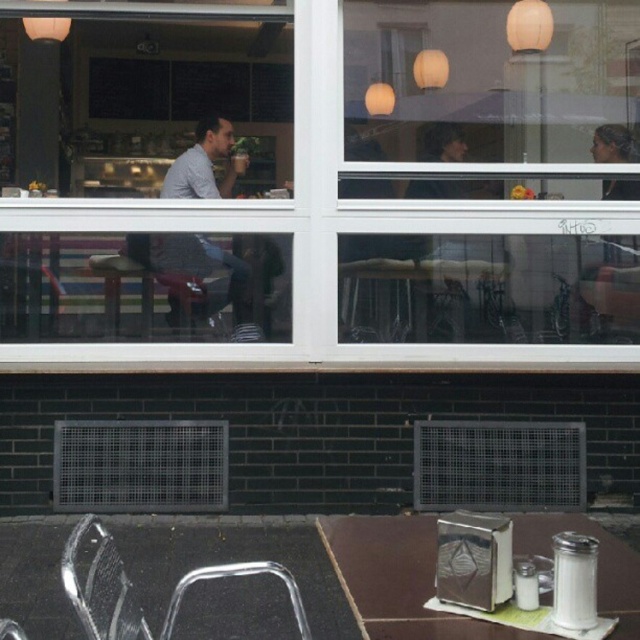
Question: Which object appears closest to the camera in this image?

Choices:
 (A) matte gray shirt at left
 (B) metallic silver chair at lower left
 (C) metallic silver napkin holder at center

Answer: (B)

Question: Which object is the closest to the metallic silver chair at lower left?

Choices:
 (A) metallic silver napkin holder at center
 (B) matte gray shirt at left

Answer: (A)

Question: Where is metallic silver napkin holder at center located in relation to matte gray shirt at left in the image?

Choices:
 (A) above
 (B) below

Answer: (B)

Question: Which of these objects is positioned farthest from the metallic silver napkin holder at center?

Choices:
 (A) metallic silver chair at lower left
 (B) matte gray shirt at left

Answer: (B)

Question: Is metallic silver napkin holder at center further to camera compared to metallic silver chair at lower left?

Choices:
 (A) yes
 (B) no

Answer: (A)

Question: Does matte gray shirt at left have a lesser width compared to metallic silver chair at lower left?

Choices:
 (A) yes
 (B) no

Answer: (A)